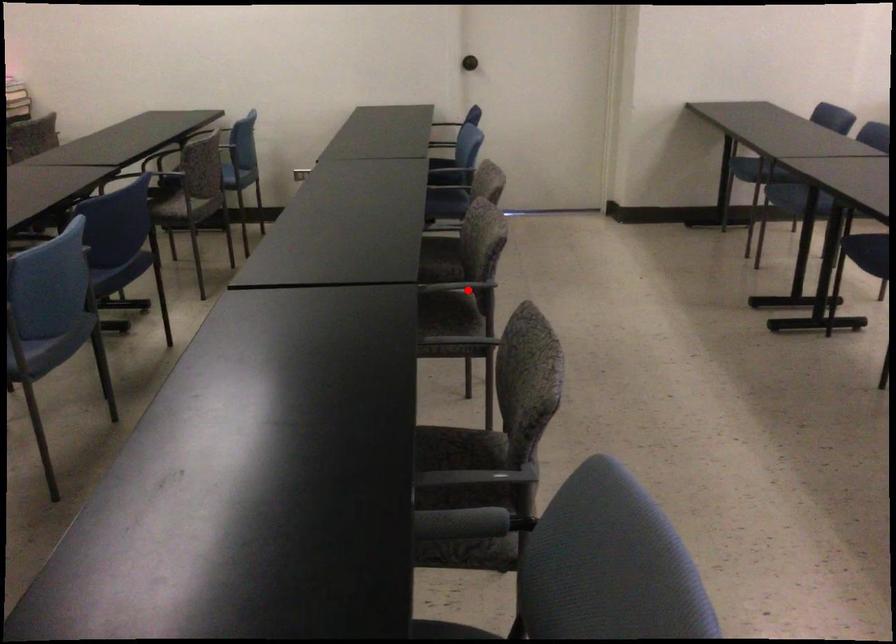
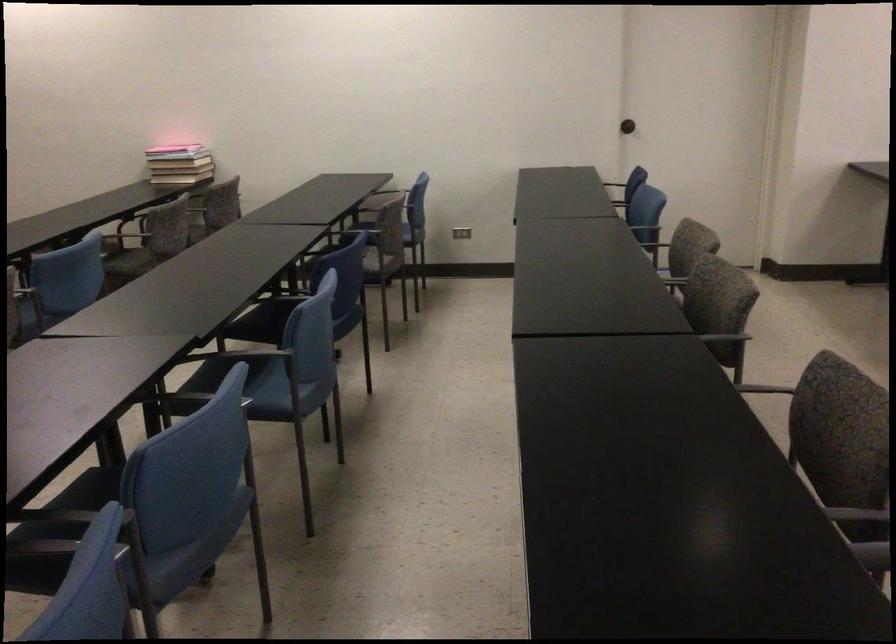
The point at the highlighted location is marked in the first image. Where is the corresponding point in the second image?

(725, 337)